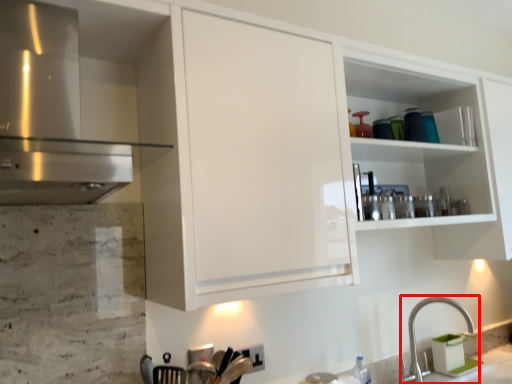
Question: Considering the relative positions of tap (annotated by the red box) and cabinetry in the image provided, where is tap (annotated by the red box) located with respect to the staircase?

Choices:
 (A) right
 (B) left

Answer: (A)